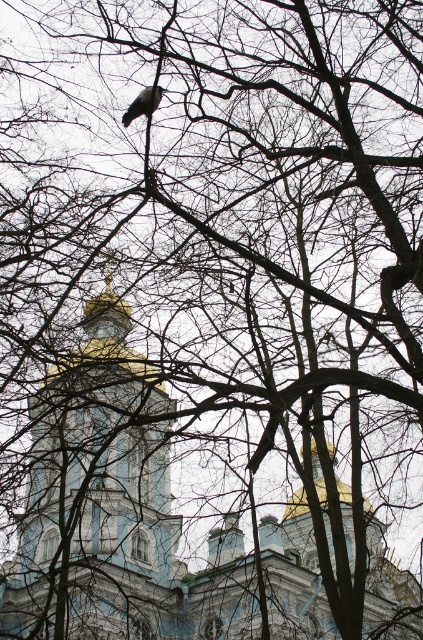
Question: Can you confirm if blue painted stone tower at center is positioned below gray matte pigeon at upper center?

Choices:
 (A) no
 (B) yes

Answer: (B)

Question: Does blue painted stone tower at center lie in front of gray matte pigeon at upper center?

Choices:
 (A) no
 (B) yes

Answer: (B)

Question: Considering the relative positions of blue painted stone tower at center and gray matte pigeon at upper center in the image provided, where is blue painted stone tower at center located with respect to gray matte pigeon at upper center?

Choices:
 (A) right
 (B) left

Answer: (B)